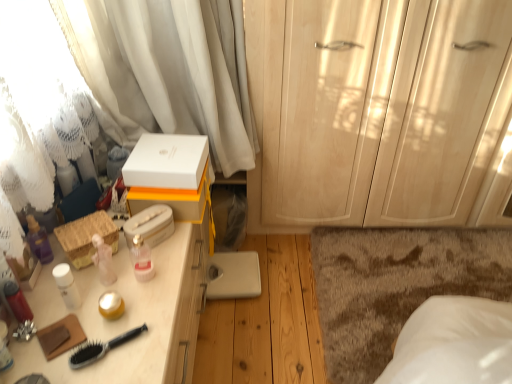
Image resolution: width=512 pixels, height=384 pixels. I want to click on vacant space that is in between woven straw basket at left, the 3th storage box viewed from the top, and pink glossy bottle at center, the 1th toiletry in the back-to-front sequence, so click(x=113, y=268).